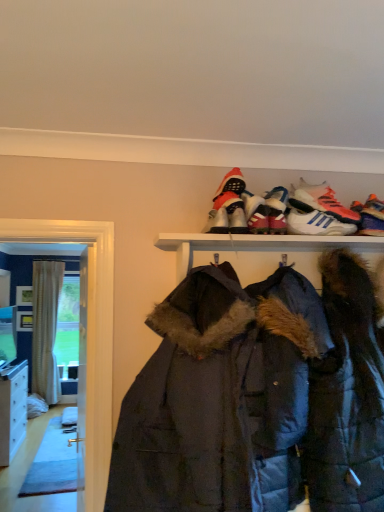
Question: Is dark blue quilted jacket at center taller or shorter than beige striped curtain at left?

Choices:
 (A) tall
 (B) short

Answer: (B)

Question: Based on their positions, is dark blue quilted jacket at center located to the left or right of beige striped curtain at left?

Choices:
 (A) right
 (B) left

Answer: (A)

Question: Based on their relative distances, which object is farther from the multicolored knitted socks at upper right, which appears as the 6th footwear when viewed from the left?

Choices:
 (A) dark blue quilted jacket at center
 (B) shiny black sneaker at upper center
 (C) white glossy cabinet at lower left
 (D) beige striped curtain at left
 (E) shiny black sneaker at upper center, the fourth footwear viewed from the right

Answer: (D)

Question: Which of these objects is positioned farthest from the multicolored knitted socks at upper right, which appears as the 6th footwear when viewed from the left?

Choices:
 (A) shiny black sneaker at upper center, the fourth footwear viewed from the right
 (B) beige striped curtain at left
 (C) shiny black sneaker at upper center
 (D) white glossy cabinet at lower left
 (E) white leather sneakers at upper center, which is the second footwear in right-to-left order

Answer: (B)